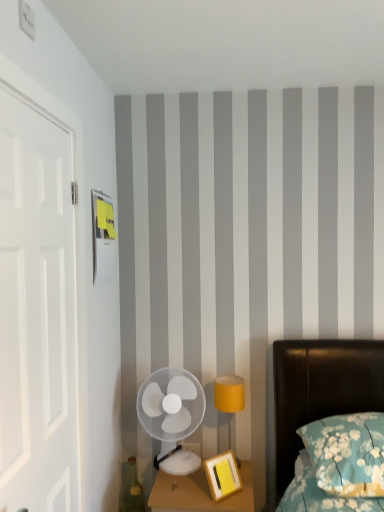
Question: Is matte yellow lampshade at right placed right next to teal floral pillow at lower right?

Choices:
 (A) no
 (B) yes

Answer: (A)

Question: Is matte yellow lampshade at right oriented away from teal floral pillow at lower right?

Choices:
 (A) no
 (B) yes

Answer: (A)

Question: Does matte yellow lampshade at right have a larger size compared to teal floral pillow at lower right?

Choices:
 (A) no
 (B) yes

Answer: (A)

Question: Is the depth of matte yellow lampshade at right less than that of teal floral pillow at lower right?

Choices:
 (A) no
 (B) yes

Answer: (A)

Question: Is matte yellow lampshade at right shorter than teal floral pillow at lower right?

Choices:
 (A) yes
 (B) no

Answer: (B)

Question: In terms of size, does white plastic fan at lower left appear bigger or smaller than wooden nightstand at lower center?

Choices:
 (A) small
 (B) big

Answer: (A)

Question: Based on their positions, is white plastic fan at lower left located to the left or right of wooden nightstand at lower center?

Choices:
 (A) right
 (B) left

Answer: (B)

Question: From the image's perspective, is white plastic fan at lower left located above or below wooden nightstand at lower center?

Choices:
 (A) above
 (B) below

Answer: (A)

Question: Do you think white plastic fan at lower left is within wooden nightstand at lower center, or outside of it?

Choices:
 (A) inside
 (B) outside

Answer: (B)

Question: From a real-world perspective, is matte yellow lampshade at right above or below wooden nightstand at lower center?

Choices:
 (A) below
 (B) above

Answer: (B)

Question: From the image's perspective, is matte yellow lampshade at right above or below wooden nightstand at lower center?

Choices:
 (A) below
 (B) above

Answer: (B)

Question: In terms of height, does matte yellow lampshade at right look taller or shorter compared to wooden nightstand at lower center?

Choices:
 (A) short
 (B) tall

Answer: (B)

Question: Based on their positions, is matte yellow lampshade at right located to the left or right of wooden nightstand at lower center?

Choices:
 (A) right
 (B) left

Answer: (A)

Question: From a real-world perspective, is teal floral pillow at lower right positioned above or below matte yellow lampshade at right?

Choices:
 (A) below
 (B) above

Answer: (B)

Question: In the image, is teal floral pillow at lower right on the left side or the right side of matte yellow lampshade at right?

Choices:
 (A) left
 (B) right

Answer: (B)